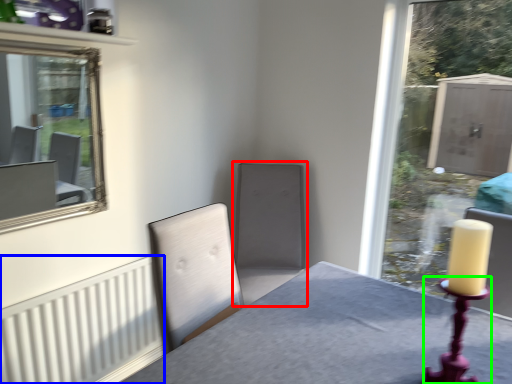
Question: Considering the real-world distances, which object is closest to swivel chair (highlighted by a red box)? radiator (highlighted by a blue box) or candle holder (highlighted by a green box).

Choices:
 (A) radiator
 (B) candle holder

Answer: (A)